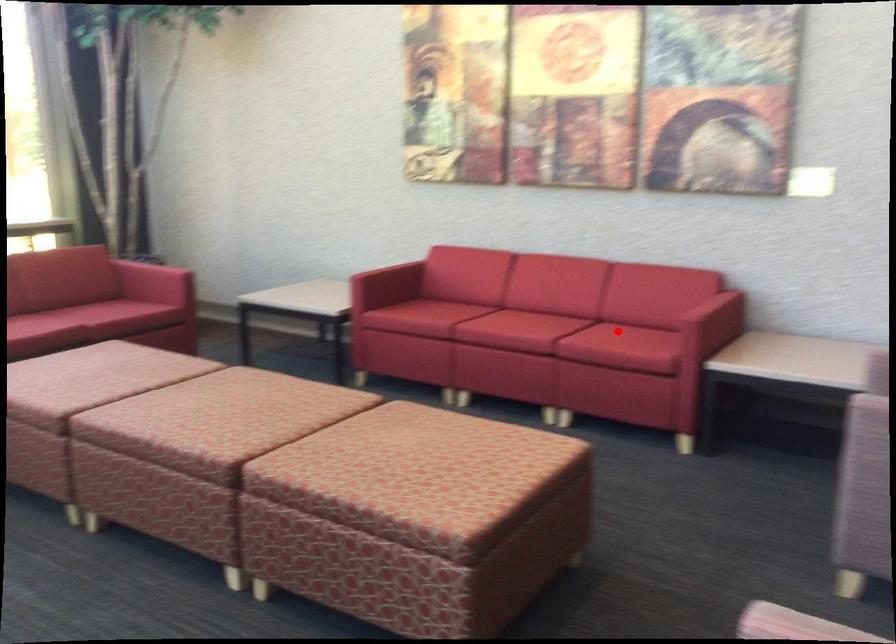
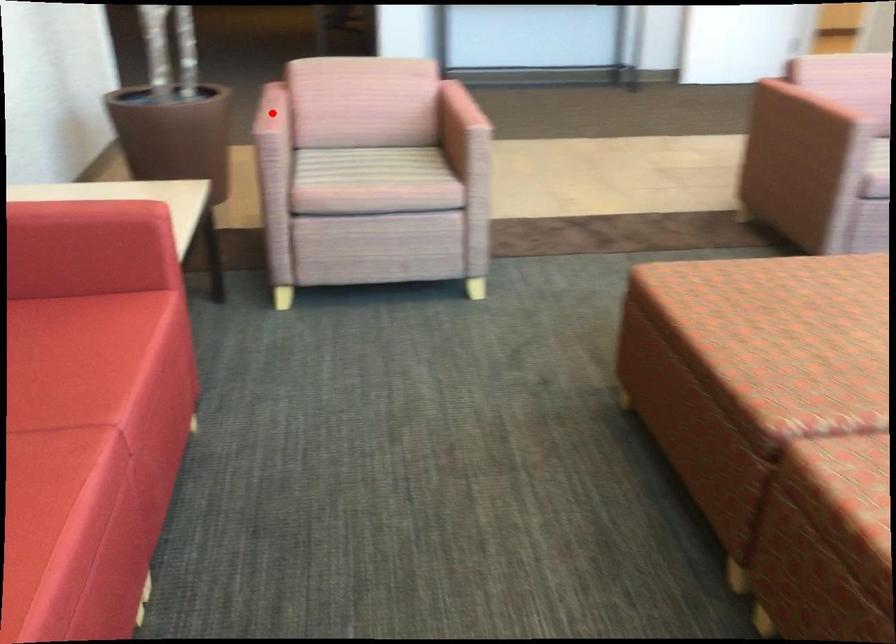
I am providing you with two images of the same scene from different viewpoints. A red point is marked on the first image and another point is marked on the second image. Are the points marked in image1 and image2 representing the same 3D position?

No